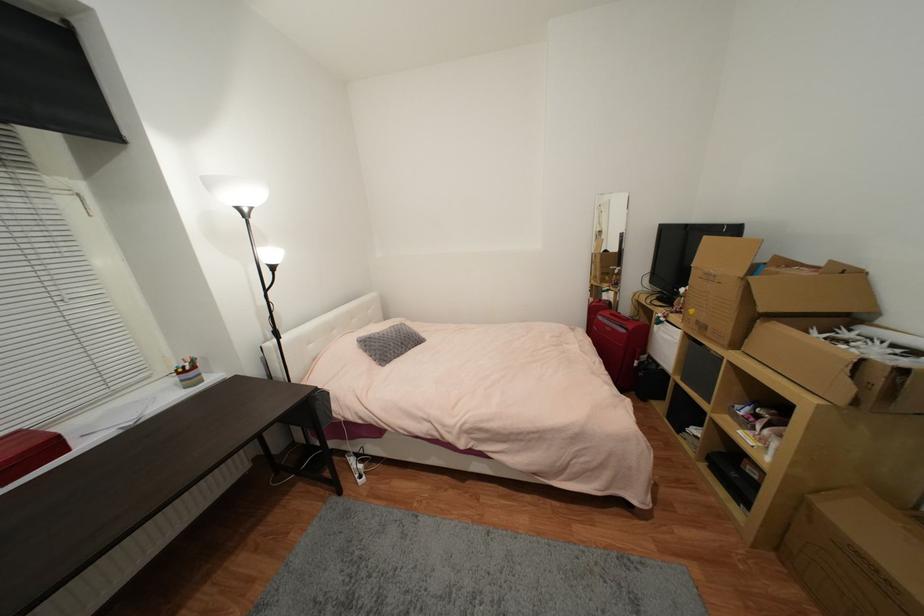
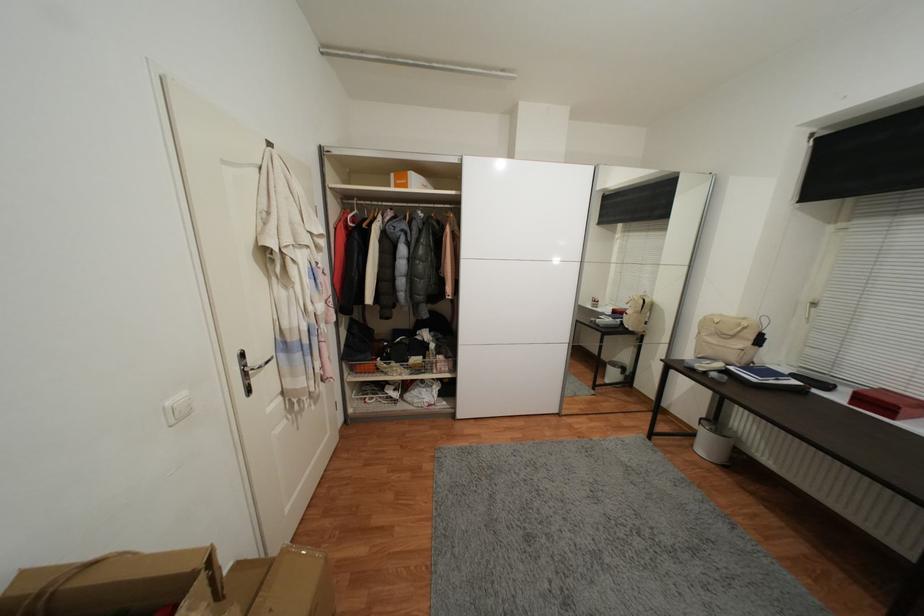
Where in the second image is the point corresponding to (71,452) from the first image?

(897, 419)